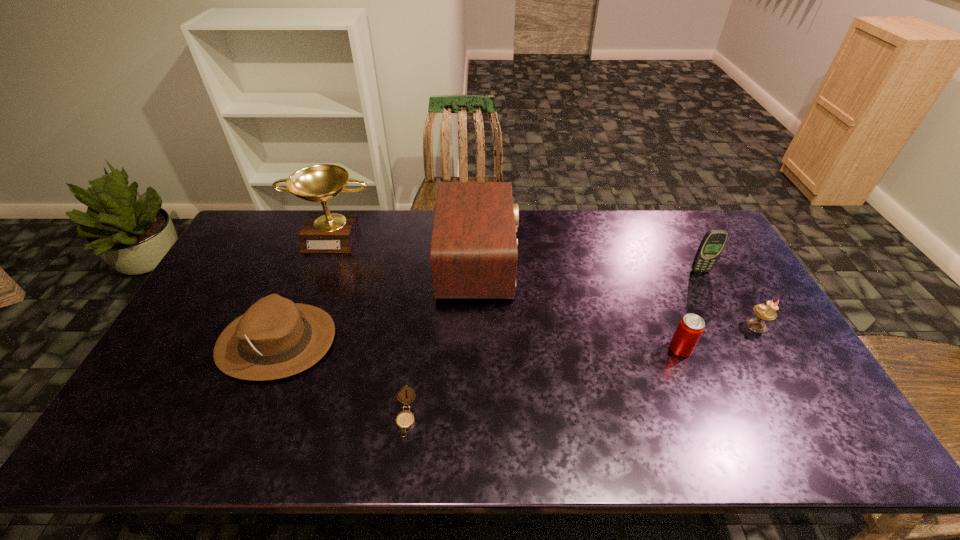
Where is `vacant area located on the screen of the cellular telephone`? The image size is (960, 540). vacant area located on the screen of the cellular telephone is located at coordinates (709, 288).

Find the location of `vacant region located on the feather side of the fedora`. vacant region located on the feather side of the fedora is located at coordinates (470, 341).

The height and width of the screenshot is (540, 960). Find the location of `vacant space located on the back of the candle holder`. vacant space located on the back of the candle holder is located at coordinates pyautogui.click(x=710, y=246).

Image resolution: width=960 pixels, height=540 pixels. I want to click on free point located on the right of the third object from right to left, so click(709, 349).

Where is `award located in the far edge section of the desktop`? The height and width of the screenshot is (540, 960). award located in the far edge section of the desktop is located at coordinates (323, 232).

You are a GUI agent. You are given a task and a screenshot of the screen. Output one action in this format:
    pyautogui.click(x=<x>, y=<y>)
    Task: Click on the radio receiver present at the far edge
    This screenshot has height=540, width=960.
    Given the screenshot: What is the action you would take?
    pyautogui.click(x=473, y=254)

Where is `object located in the near edge section of the desktop`? The width and height of the screenshot is (960, 540). object located in the near edge section of the desktop is located at coordinates (405, 419).

Locate an element on the screen. Image resolution: width=960 pixels, height=540 pixels. object present at the left edge is located at coordinates (275, 338).

I want to click on cellular telephone present at the right edge, so click(714, 241).

Locate an element on the screen. candle holder located in the right edge section of the desktop is located at coordinates (767, 312).